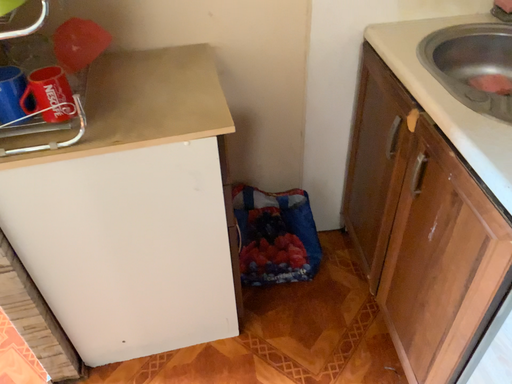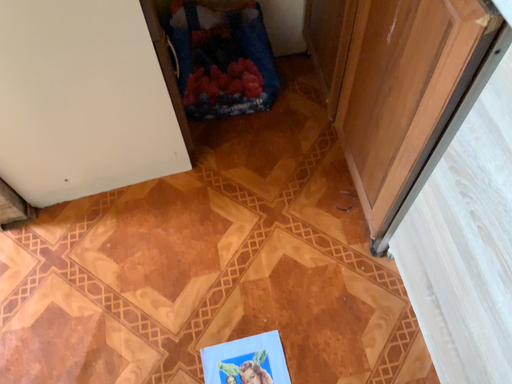
Question: Which way did the camera rotate in the video?

Choices:
 (A) rotated downward
 (B) rotated upward

Answer: (A)